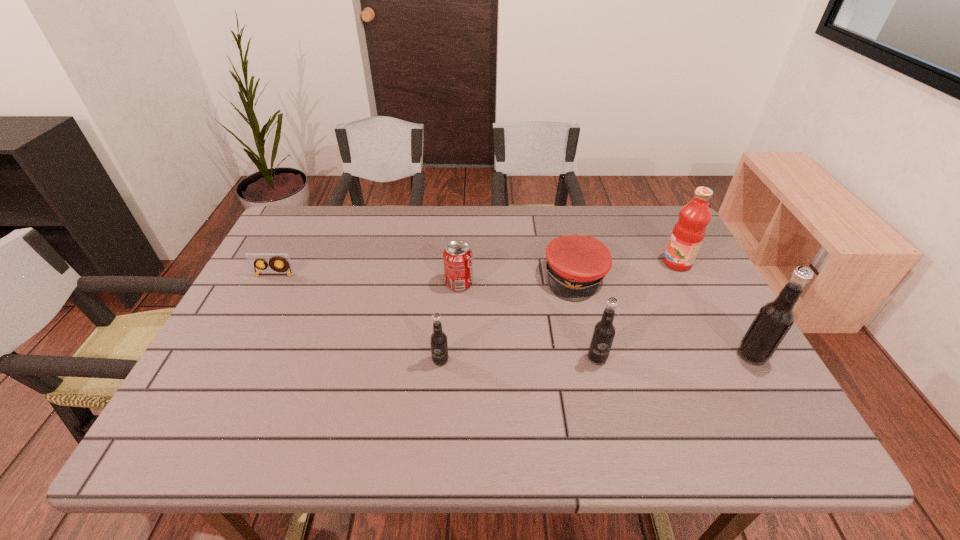
The image size is (960, 540). In order to click on fruit juice that is at the right edge in this screenshot , I will do `click(689, 231)`.

I want to click on free space at the far edge of the desktop, so click(x=544, y=250).

What are the coordinates of `vacant region at the near edge of the desktop` in the screenshot? It's located at (698, 402).

In the image, there is a desktop. At what (x,y) coordinates should I click in order to perform the action: click on vacant space at the left edge. Please return your answer as a coordinate pair (x, y). Looking at the image, I should click on (236, 347).

The image size is (960, 540). In the image, there is a desktop. What are the coordinates of `vacant space at the right edge` in the screenshot? It's located at 698,298.

You are a GUI agent. You are given a task and a screenshot of the screen. Output one action in this format:
    pyautogui.click(x=<x>, y=<y>)
    Task: Click on the free space at the far right corner of the desktop
    
    Given the screenshot: What is the action you would take?
    pyautogui.click(x=641, y=207)

At what (x,y) coordinates should I click in order to perform the action: click on vacant space at the near right corner. Please return your answer as a coordinate pair (x, y). Image resolution: width=960 pixels, height=540 pixels. Looking at the image, I should click on (735, 385).

You are a GUI agent. You are given a task and a screenshot of the screen. Output one action in this format:
    pyautogui.click(x=<x>, y=<y>)
    Task: Click on the unoccupied area between the fifth shortest object and the fifth tallest object
    
    Given the screenshot: What is the action you would take?
    pyautogui.click(x=528, y=321)

Locate an element on the screen. Image resolution: width=960 pixels, height=540 pixels. vacant space that is in between the second shortest object and the second root beer from left to right is located at coordinates (587, 318).

The height and width of the screenshot is (540, 960). In order to click on vacant area that lies between the soda can and the fifth shortest object in this screenshot , I will do `click(528, 321)`.